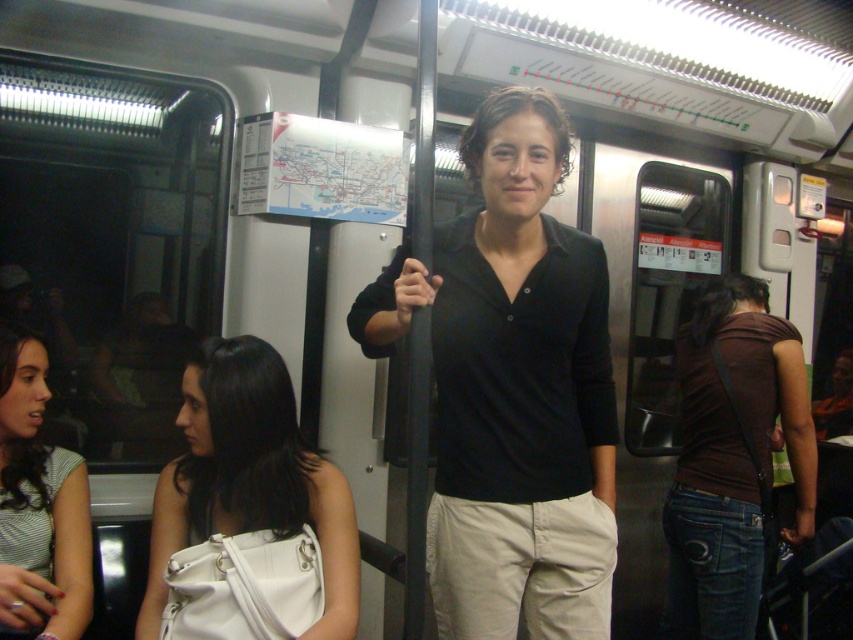
You are a photographer standing in the subway train and want to take a photo of the black matte shirt at center and the brown matte shirt at center. Which one will appear larger in your photo?

The black matte shirt at center will appear larger in the photo because it is closer to the viewer than the brown matte shirt at center.

You are a passenger on the subway train and want to put your striped fabric shirt at lower left into your white matte bag at center left. Can you do that without moving the bag?

The striped fabric shirt at lower left is behind the white matte bag at center left, so you cannot put it into the bag without moving the bag first.